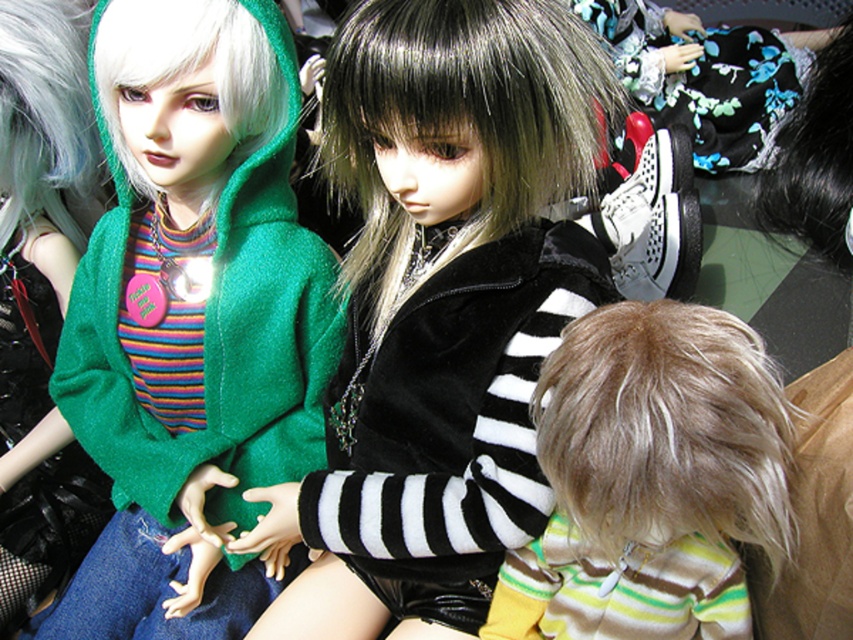
You are a customer at a doll store and want to know the position of the green matte hoodie at left relative to the white matte wig at upper left. Can you tell me if the hoodie is above or below the wig?

The green matte hoodie at left is located below the white matte wig at upper left, so the hoodie is below the wig.

You are a customer at a doll store and want to buy a wig that is wider than the one on the upper right. Which wig should you choose between the black silky wig at center and the black silky hair at upper right?

The black silky wig at center might be wider than black silky hair at upper right, so you should choose the black silky wig at center.

You are standing in front of a doll display and notice two points marked on the dolls. The first point is at coordinates point (x=223, y=179) and the second is at point (x=776, y=132). Which of these points is closer to you?

Point (x=223, y=179) is further to the viewer than point (x=776, y=132), so the point closer to you is point (x=776, y=132).